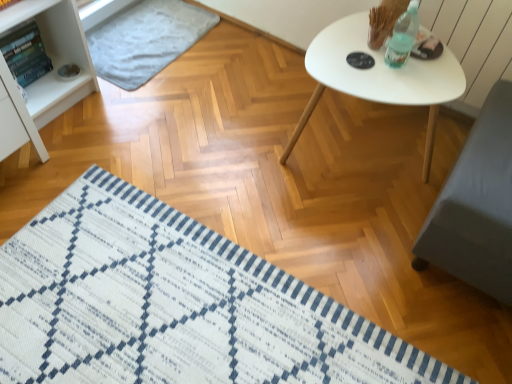
Locate an element on the screen. The image size is (512, 384). unoccupied region to the right of light gray textured mat at upper left, acting as the first mat starting from the back is located at coordinates (234, 69).